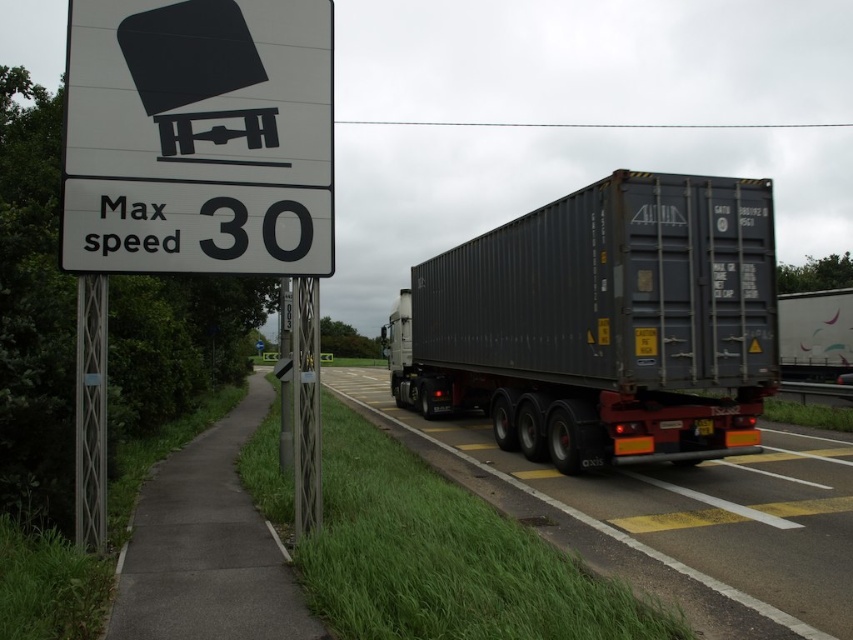
Question: Which point is farther to the camera?

Choices:
 (A) white paper sign at upper left
 (B) matte black trailer truck at center
 (C) metallic gray trailer at center

Answer: (B)

Question: Which object is farther from the camera taking this photo?

Choices:
 (A) metallic gray trailer at center
 (B) matte black trailer truck at center

Answer: (B)

Question: Is matte black trailer truck at center above white paper sign at upper left?

Choices:
 (A) yes
 (B) no

Answer: (B)

Question: Does white paper sign at upper left appear over metallic gray trailer at center?

Choices:
 (A) no
 (B) yes

Answer: (B)

Question: Does white paper sign at upper left have a greater width compared to metallic gray trailer at center?

Choices:
 (A) no
 (B) yes

Answer: (A)

Question: Based on their relative distances, which object is farther from the white paper sign at upper left?

Choices:
 (A) matte black trailer truck at center
 (B) metallic gray trailer at center

Answer: (A)